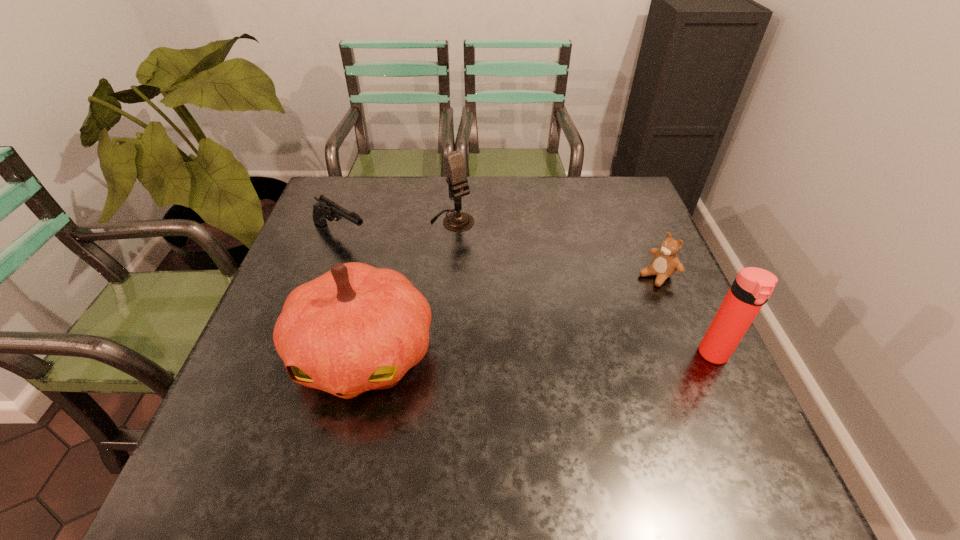
Identify the location of pumpkin. Image resolution: width=960 pixels, height=540 pixels. (356, 328).

I want to click on thermos bottle, so click(x=752, y=287).

Image resolution: width=960 pixels, height=540 pixels. Find the location of `teddy bear`. teddy bear is located at coordinates (665, 263).

Identify the location of microphone. (455, 169).

You are a GUI agent. You are given a task and a screenshot of the screen. Output one action in this format:
    pyautogui.click(x=<x>, y=<y>)
    Task: Click on the gun
    The width and height of the screenshot is (960, 540).
    Given the screenshot: What is the action you would take?
    point(325,209)

Where is `vacant space located on the left of the thermos bottle`? vacant space located on the left of the thermos bottle is located at coordinates [593, 355].

The height and width of the screenshot is (540, 960). Find the location of `vacant space situated on the front-facing side of the teddy bear`. vacant space situated on the front-facing side of the teddy bear is located at coordinates (582, 326).

Locate an element on the screen. The width and height of the screenshot is (960, 540). vacant position located 0.220m on the front-facing side of the teddy bear is located at coordinates (585, 325).

You are a GUI agent. You are given a task and a screenshot of the screen. Output one action in this format:
    pyautogui.click(x=<x>, y=<y>)
    Task: Click on the vacant space positioned 0.110m on the front-facing side of the teddy bear
    
    Given the screenshot: What is the action you would take?
    pyautogui.click(x=616, y=303)

Identify the location of blank space located on the front-facing side of the microphone. (544, 308).